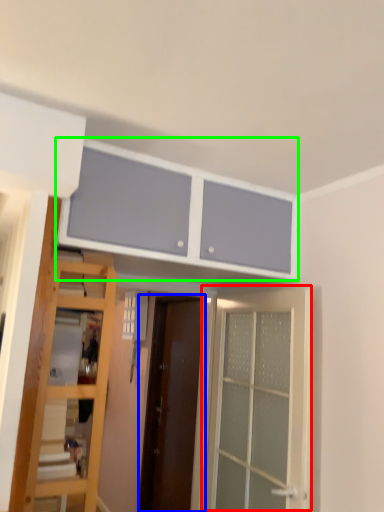
Question: Estimate the real-world distances between objects in this image. Which object is closer to door (highlighted by a red box), door (highlighted by a blue box) or cabinetry (highlighted by a green box)?

Choices:
 (A) door
 (B) cabinetry

Answer: (B)